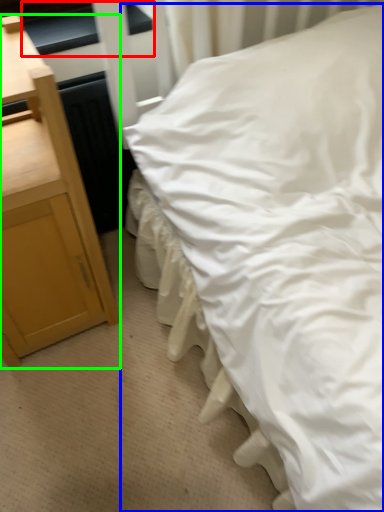
Question: Estimate the real-world distances between objects in this image. Which object is farther from window sill (highlighted by a red box), bed (highlighted by a blue box) or nightstand (highlighted by a green box)?

Choices:
 (A) bed
 (B) nightstand

Answer: (A)